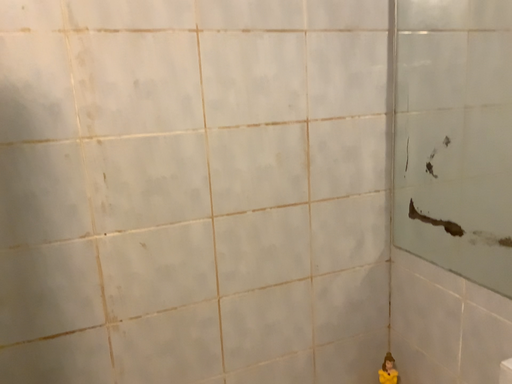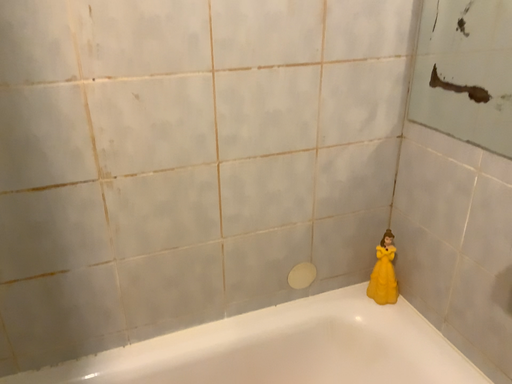
Question: Which way did the camera rotate in the video?

Choices:
 (A) rotated downward
 (B) rotated upward

Answer: (A)